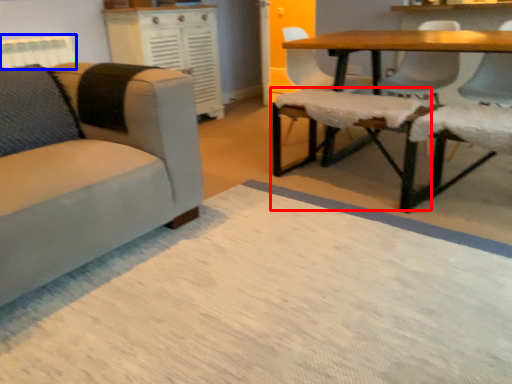
Question: Among these objects, which one is farthest to the camera, swivel chair (highlighted by a red box) or radiator (highlighted by a blue box)?

Choices:
 (A) swivel chair
 (B) radiator

Answer: (B)